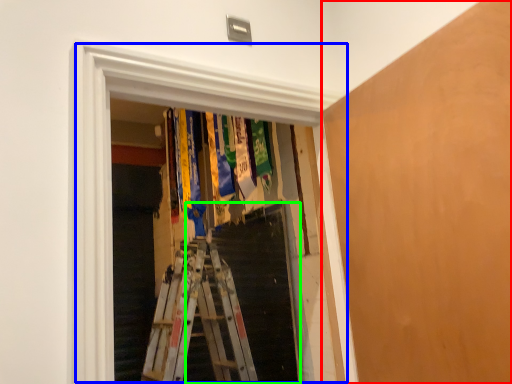
Question: Which object is positioned closest to plywood (highlighted by a red box)? Select from window (highlighted by a blue box) and stairs (highlighted by a green box).

Choices:
 (A) window
 (B) stairs

Answer: (A)